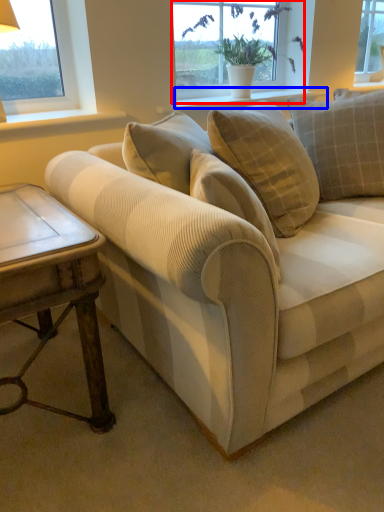
Question: Which point is closer to the camera, window (highlighted by a red box) or window sill (highlighted by a blue box)?

Choices:
 (A) window
 (B) window sill

Answer: (B)